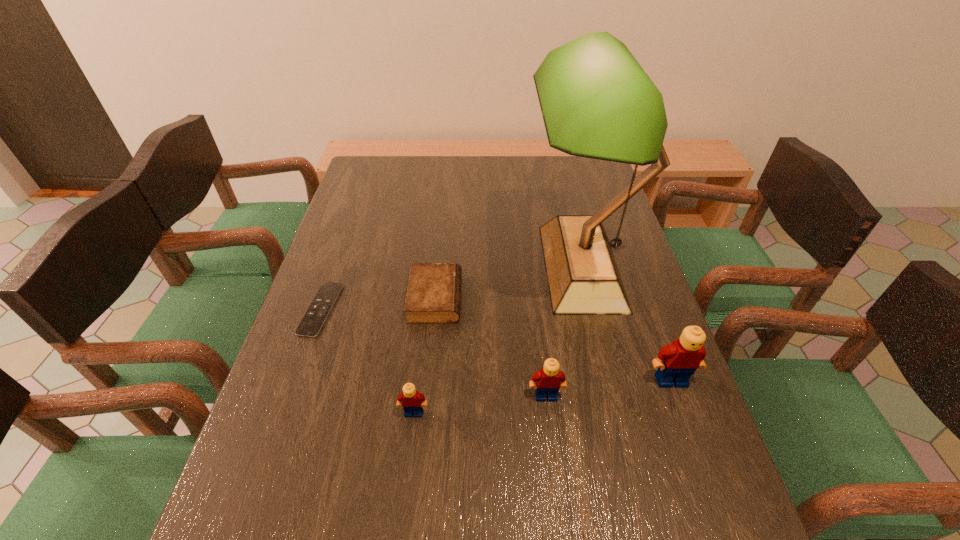
Locate an element on the screen. The image size is (960, 540). the fourth tallest object is located at coordinates (411, 401).

The image size is (960, 540). What are the coordinates of `the nearest object` in the screenshot? It's located at coord(411,401).

I want to click on the second shortest Lego, so click(549, 379).

Find the location of a particular element. the second Lego from left to right is located at coordinates (549, 379).

This screenshot has height=540, width=960. Identify the location of the rightmost Lego. (676, 362).

Find the location of a particular element. This screenshot has height=540, width=960. the second tallest object is located at coordinates (676, 362).

The width and height of the screenshot is (960, 540). In order to click on the second shortest object in this screenshot , I will do `click(433, 295)`.

I want to click on the shortest object, so click(x=312, y=322).

This screenshot has height=540, width=960. In order to click on remote control in this screenshot , I will do `click(312, 322)`.

Where is `table lamp`? The width and height of the screenshot is (960, 540). table lamp is located at coordinates (597, 102).